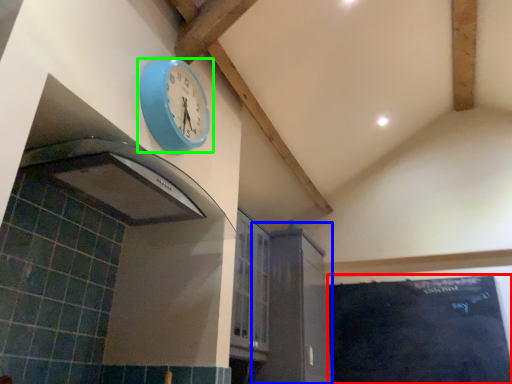
Question: Considering the real-world distances, which object is closest to bulletin board (highlighted by a red box)? cabinetry (highlighted by a blue box) or wall clock (highlighted by a green box).

Choices:
 (A) cabinetry
 (B) wall clock

Answer: (A)